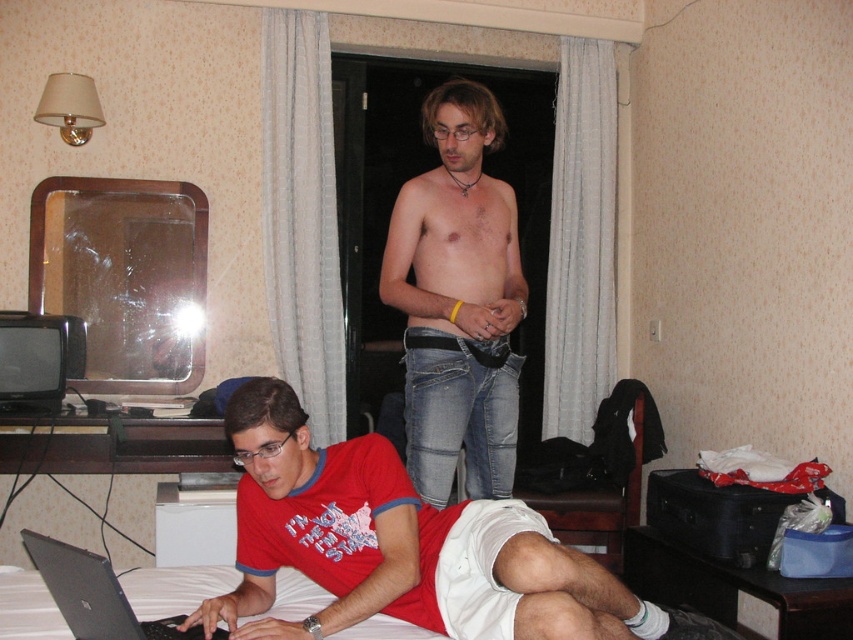
Based on the photo, can you confirm if denim jeans at center is smaller than silver metallic laptop at lower left?

Incorrect, denim jeans at center is not smaller in size than silver metallic laptop at lower left.

Is denim jeans at center below silver metallic laptop at lower left?

No.

In order to click on denim jeans at center in this screenshot , I will do `click(457, 300)`.

This screenshot has width=853, height=640. Identify the location of denim jeans at center. (457, 300).

Between red cotton t-shirt at lower left and denim jeans at center, which one has more height?

With more height is denim jeans at center.

The width and height of the screenshot is (853, 640). What do you see at coordinates (404, 547) in the screenshot? I see `red cotton t-shirt at lower left` at bounding box center [404, 547].

The image size is (853, 640). In order to click on red cotton t-shirt at lower left in this screenshot , I will do `click(404, 547)`.

Does red cotton t-shirt at lower left have a lesser width compared to silver metallic laptop at lower left?

No.

Measure the distance between red cotton t-shirt at lower left and silver metallic laptop at lower left.

red cotton t-shirt at lower left is 14.93 inches from silver metallic laptop at lower left.

Does point (260, 612) lie in front of point (160, 628)?

That is False.

Where is `red cotton t-shirt at lower left`? This screenshot has width=853, height=640. red cotton t-shirt at lower left is located at coordinates (404, 547).